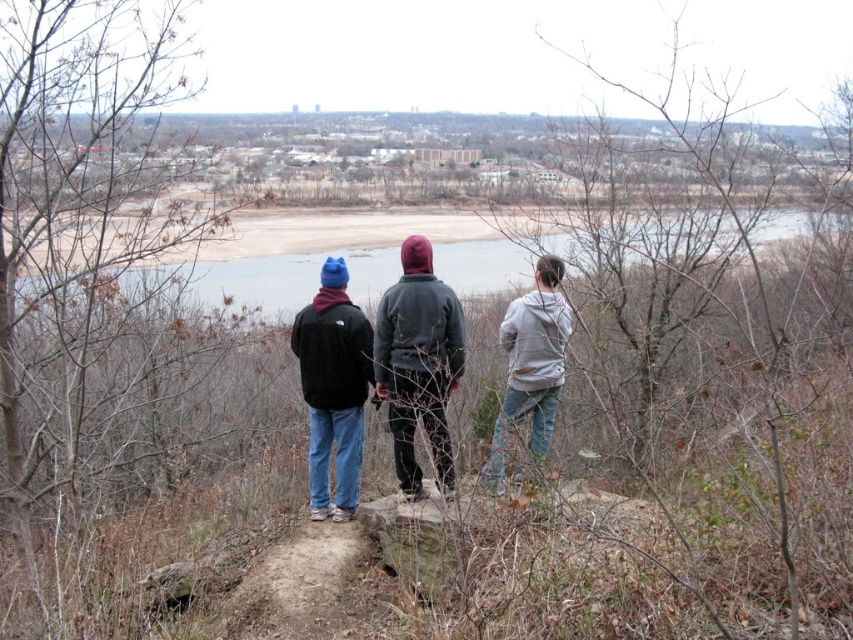
Question: Does matte black jacket at center appear on the right side of gray fleece jacket at center?

Choices:
 (A) no
 (B) yes

Answer: (A)

Question: Is the position of gray smooth water at center more distant than that of matte black jacket at center?

Choices:
 (A) yes
 (B) no

Answer: (A)

Question: Is gray smooth water at center to the left of dark gray hoodie at center from the viewer's perspective?

Choices:
 (A) yes
 (B) no

Answer: (B)

Question: Considering the real-world distances, which object is closest to the dark gray hoodie at center?

Choices:
 (A) gray fleece jacket at center
 (B) gray smooth water at center

Answer: (A)

Question: Which object appears farthest from the camera in this image?

Choices:
 (A) gray smooth water at center
 (B) gray fleece jacket at center
 (C) dark gray hoodie at center

Answer: (A)

Question: Which object is positioned farthest from the gray smooth water at center?

Choices:
 (A) gray fleece jacket at center
 (B) matte black jacket at center

Answer: (A)